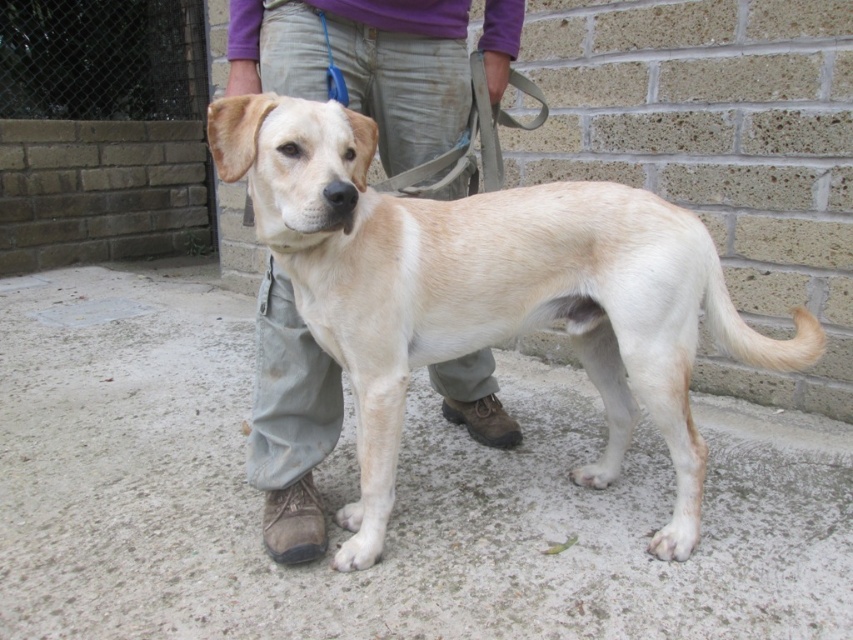
Question: Which point is farther from the camera taking this photo?

Choices:
 (A) (480, 289)
 (B) (387, 152)

Answer: (B)

Question: Is the position of light beige fur at center more distant than that of light beige pants at center?

Choices:
 (A) no
 (B) yes

Answer: (A)

Question: Is light beige fur at center thinner than light beige pants at center?

Choices:
 (A) yes
 (B) no

Answer: (B)

Question: Does light beige fur at center appear under light beige pants at center?

Choices:
 (A) yes
 (B) no

Answer: (A)